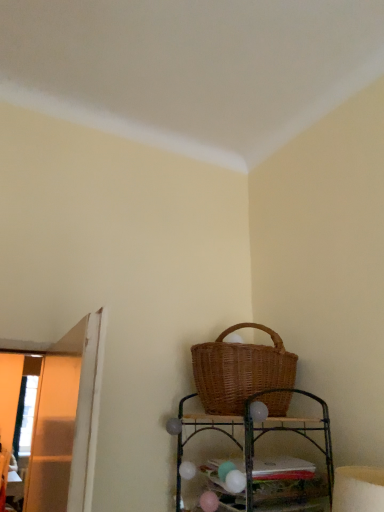
Question: Is woven brown picnic basket at upper right smaller than woven wood shelf at lower center?

Choices:
 (A) no
 (B) yes

Answer: (A)

Question: Considering the relative sizes of woven brown picnic basket at upper right and woven wood shelf at lower center in the image provided, is woven brown picnic basket at upper right thinner than woven wood shelf at lower center?

Choices:
 (A) yes
 (B) no

Answer: (B)

Question: Does woven brown picnic basket at upper right have a greater height compared to woven wood shelf at lower center?

Choices:
 (A) no
 (B) yes

Answer: (A)

Question: Does woven brown picnic basket at upper right have a larger size compared to woven wood shelf at lower center?

Choices:
 (A) yes
 (B) no

Answer: (A)

Question: From the image's perspective, is woven brown picnic basket at upper right under woven wood shelf at lower center?

Choices:
 (A) no
 (B) yes

Answer: (A)

Question: Can woven wood shelf at lower center be found inside woven brown picnic basket at upper right?

Choices:
 (A) no
 (B) yes

Answer: (A)

Question: Can you confirm if woven wood shelf at lower center is shorter than woven brown picnic basket at upper right?

Choices:
 (A) yes
 (B) no

Answer: (B)

Question: Can you confirm if woven wood shelf at lower center is taller than woven brown picnic basket at upper right?

Choices:
 (A) no
 (B) yes

Answer: (B)

Question: Considering the relative sizes of woven wood shelf at lower center and woven brown picnic basket at upper right in the image provided, is woven wood shelf at lower center wider than woven brown picnic basket at upper right?

Choices:
 (A) yes
 (B) no

Answer: (B)

Question: Can you confirm if woven wood shelf at lower center is bigger than woven brown picnic basket at upper right?

Choices:
 (A) yes
 (B) no

Answer: (B)

Question: Is there a large distance between woven wood shelf at lower center and woven brown picnic basket at upper right?

Choices:
 (A) yes
 (B) no

Answer: (B)

Question: From a real-world perspective, is woven wood shelf at lower center positioned under woven brown picnic basket at upper right based on gravity?

Choices:
 (A) no
 (B) yes

Answer: (B)

Question: From a real-world perspective, is woven wood shelf at lower center positioned above or below woven brown picnic basket at upper right?

Choices:
 (A) below
 (B) above

Answer: (A)